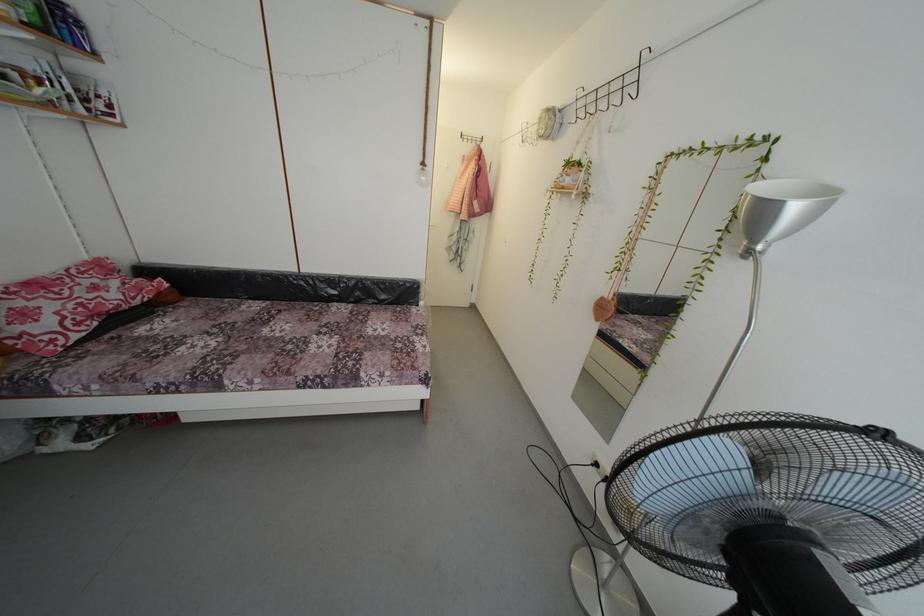
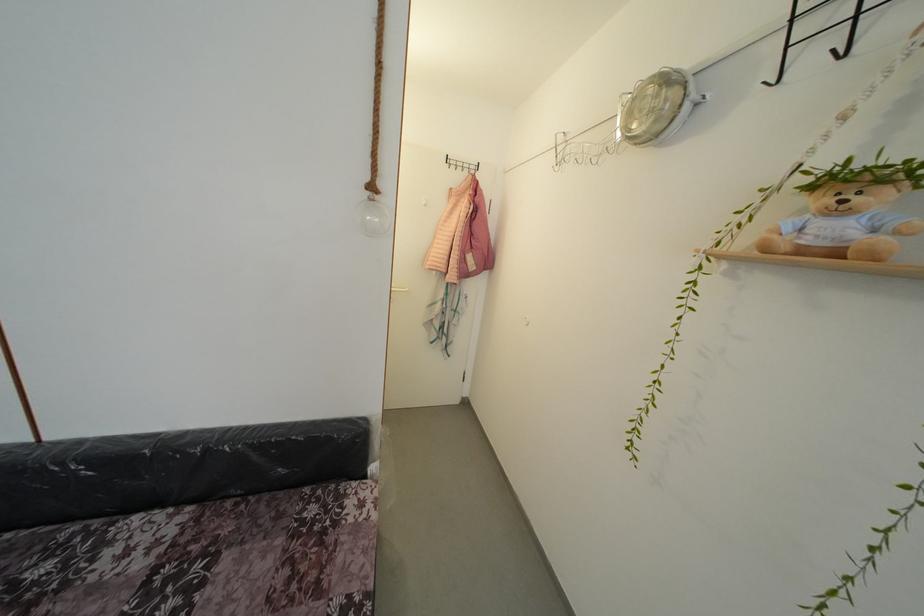
Question: Which direction would the cameraman need to move to produce the second image? Reply with the corresponding letter.

Choices:
 (A) Left
 (B) Right
 (C) Forward
 (D) Backward

Answer: (C)